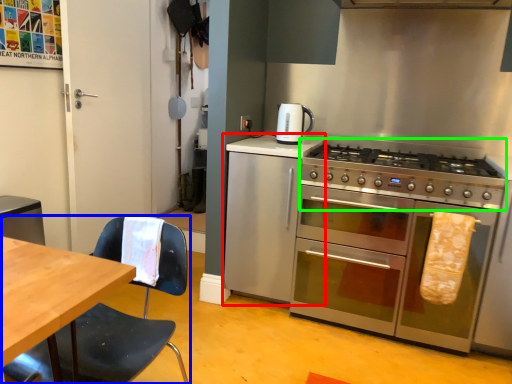
Question: Which object is positioned closest to cabinetry (highlighted by a red box)? Select from chair (highlighted by a blue box) and gas stove (highlighted by a green box).

Choices:
 (A) chair
 (B) gas stove

Answer: (B)